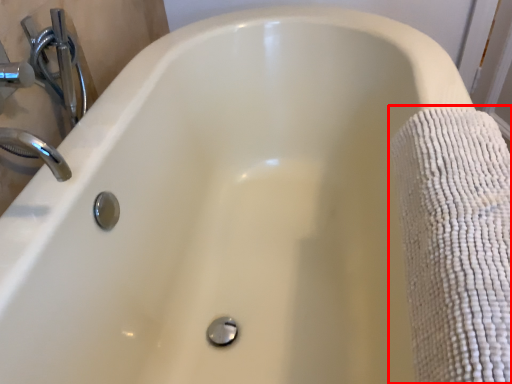
Question: From the image's perspective, what is the correct spatial relationship of bath towel (annotated by the red box) in relation to plumbing fixture?

Choices:
 (A) below
 (B) above

Answer: (A)